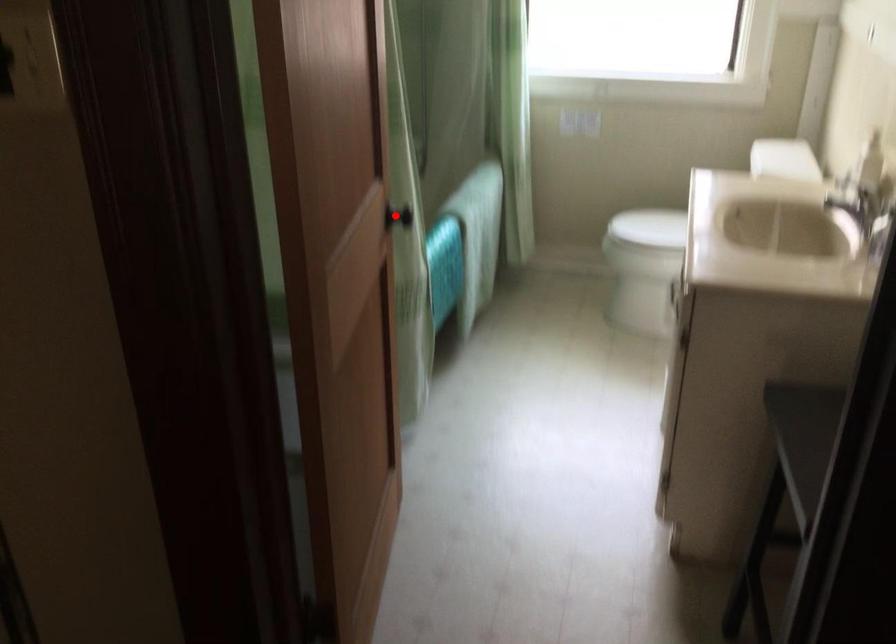
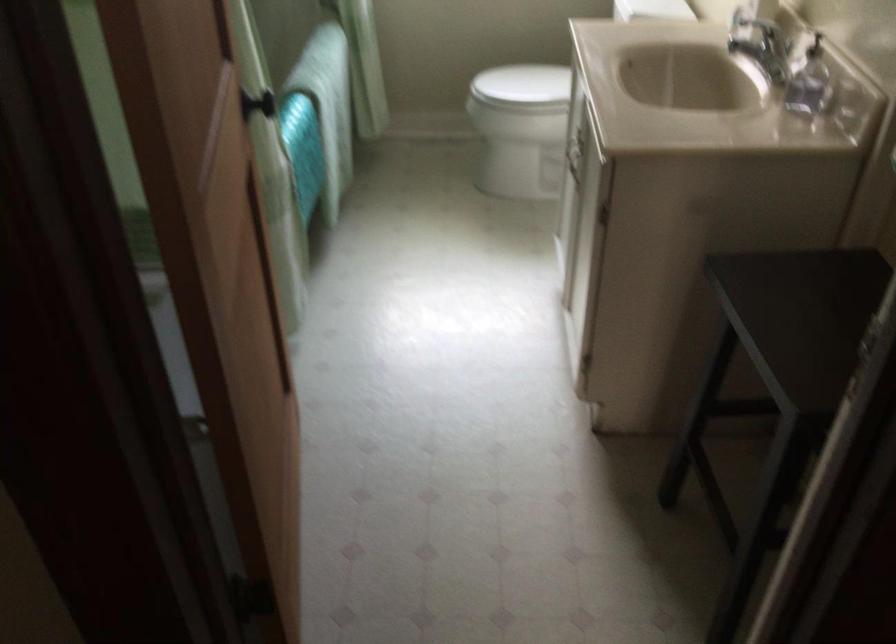
Question: I am providing you with two images of the same scene from different viewpoints. Given a red point in image1, look at the same physical point in image2. Is it:

Choices:
 (A) Closer to the viewpoint
 (B) Farther from the viewpoint

Answer: (A)